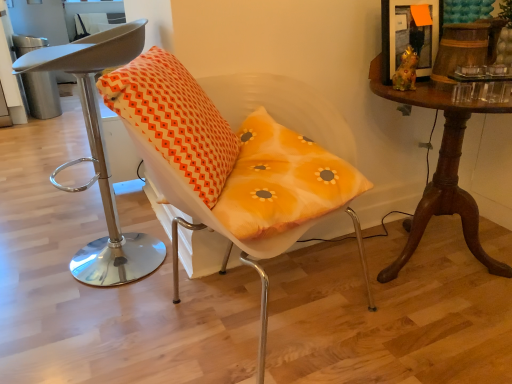
Question: Does matte orange cushion at center, the first chair positioned from the right, turn towards mahogany wood table at right?

Choices:
 (A) yes
 (B) no

Answer: (B)

Question: Can you confirm if matte orange cushion at center, the first chair positioned from the right, is bigger than mahogany wood table at right?

Choices:
 (A) no
 (B) yes

Answer: (B)

Question: Does matte orange cushion at center, the first chair positioned from the right, have a smaller size compared to mahogany wood table at right?

Choices:
 (A) no
 (B) yes

Answer: (A)

Question: From the image's perspective, is matte orange cushion at center, arranged as the 2th chair when viewed from the left, located above mahogany wood table at right?

Choices:
 (A) no
 (B) yes

Answer: (A)

Question: Is matte orange cushion at center, the first chair positioned from the right, positioned behind mahogany wood table at right?

Choices:
 (A) no
 (B) yes

Answer: (A)

Question: Considering the relative sizes of matte orange cushion at center, the first chair positioned from the right, and mahogany wood table at right in the image provided, is matte orange cushion at center, the first chair positioned from the right, taller than mahogany wood table at right?

Choices:
 (A) no
 (B) yes

Answer: (B)

Question: Considering the relative sizes of matte gray stool at left, which is counted as the first chair, starting from the left, and orange printed cushion at center in the image provided, is matte gray stool at left, which is counted as the first chair, starting from the left, shorter than orange printed cushion at center?

Choices:
 (A) yes
 (B) no

Answer: (B)

Question: Is matte gray stool at left, the second chair viewed from the right, closer to camera compared to orange printed cushion at center?

Choices:
 (A) no
 (B) yes

Answer: (A)

Question: Considering the relative sizes of matte gray stool at left, the second chair viewed from the right, and orange printed cushion at center in the image provided, is matte gray stool at left, the second chair viewed from the right, thinner than orange printed cushion at center?

Choices:
 (A) no
 (B) yes

Answer: (B)

Question: Can you confirm if matte gray stool at left, which is counted as the first chair, starting from the left, is positioned to the left of orange printed cushion at center?

Choices:
 (A) no
 (B) yes

Answer: (B)

Question: From the image's perspective, is matte gray stool at left, which is counted as the first chair, starting from the left, under orange printed cushion at center?

Choices:
 (A) yes
 (B) no

Answer: (A)

Question: Is matte gray stool at left, which is counted as the first chair, starting from the left, facing away from orange printed cushion at center?

Choices:
 (A) yes
 (B) no

Answer: (B)

Question: Does orange printed cushion at center have a lesser height compared to matte orange cushion at center, the first chair positioned from the right?

Choices:
 (A) yes
 (B) no

Answer: (A)